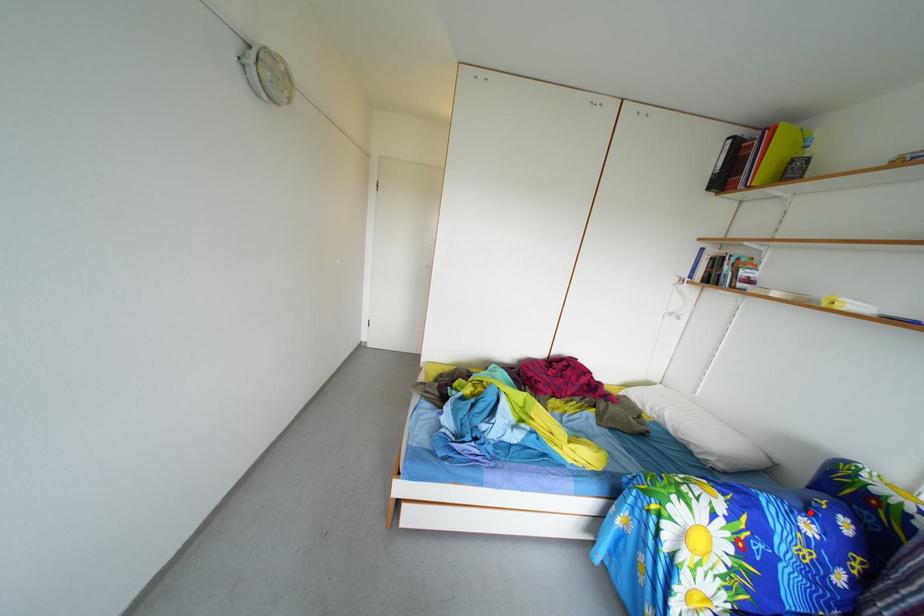
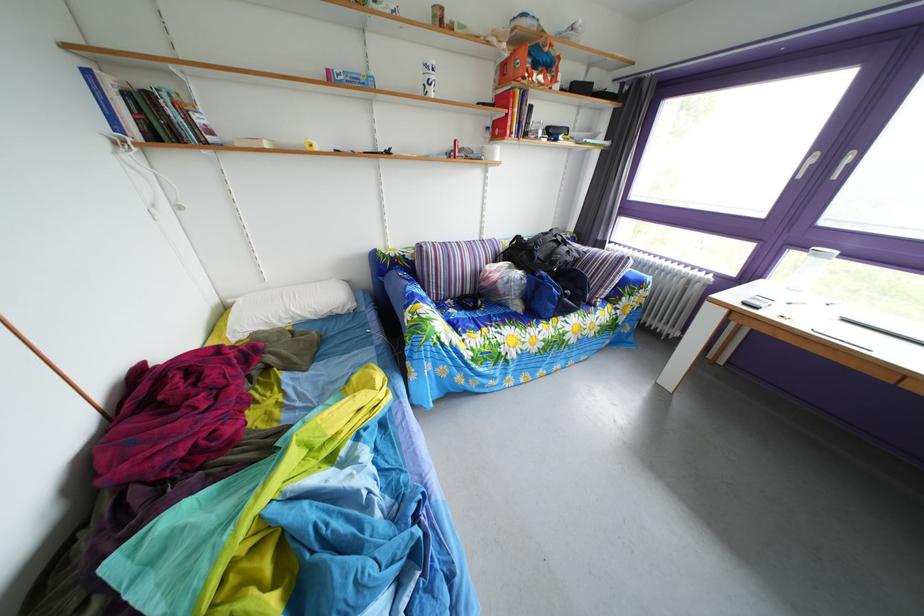
Question: I am providing you with two images of the same scene from different viewpoints. A red point is shown in image1. For the corresponding object point in image2, is it positioned nearer or farther from the camera?

Choices:
 (A) Nearer
 (B) Farther

Answer: (A)